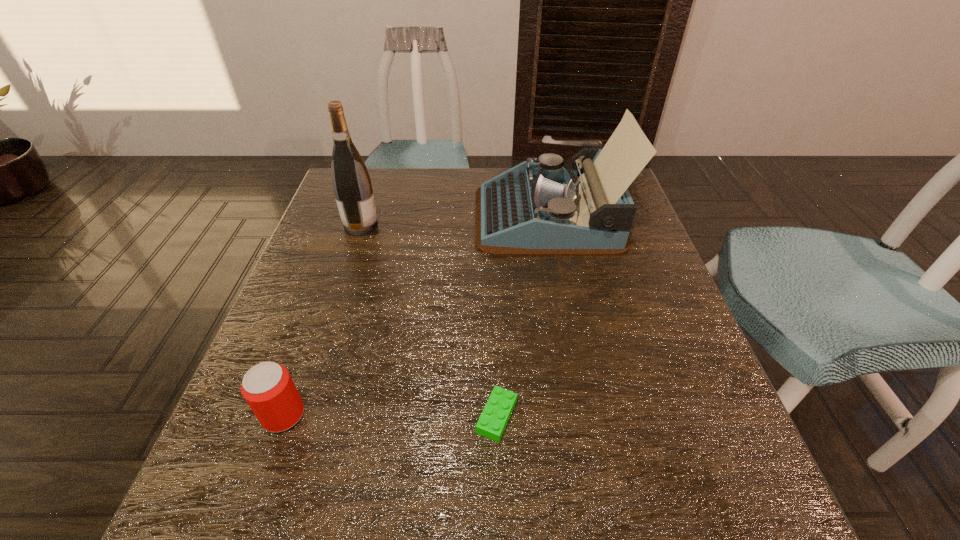
The image size is (960, 540). In order to click on vacant space at the near left corner of the desktop in this screenshot , I will do `click(211, 535)`.

Image resolution: width=960 pixels, height=540 pixels. I want to click on free space that is in between the shortest object and the tallest object, so point(429,321).

Find the location of a particular element. blank region between the wine bottle and the typewriter is located at coordinates (454, 221).

Image resolution: width=960 pixels, height=540 pixels. In order to click on free space between the beer can and the tallest object in this screenshot , I will do `click(323, 320)`.

Find the location of a particular element. free space that is in between the tallest object and the typewriter is located at coordinates (454, 221).

The width and height of the screenshot is (960, 540). Identify the location of free space that is in between the second tallest object and the Lego. (522, 316).

This screenshot has height=540, width=960. I want to click on vacant region between the shortest object and the third shortest object, so click(x=522, y=316).

Where is `blank region between the wine bottle and the second tallest object`? Image resolution: width=960 pixels, height=540 pixels. blank region between the wine bottle and the second tallest object is located at coordinates (454, 221).

Image resolution: width=960 pixels, height=540 pixels. Find the location of `vacant area between the beer can and the tallest object`. vacant area between the beer can and the tallest object is located at coordinates (323, 320).

Image resolution: width=960 pixels, height=540 pixels. I want to click on empty location between the second shortest object and the second tallest object, so click(416, 315).